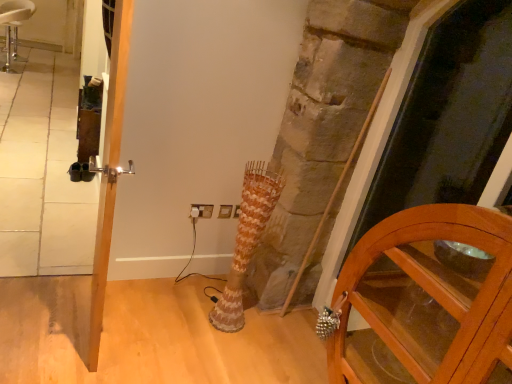
This screenshot has width=512, height=384. In order to click on free space behind polished silver door handle at left in this screenshot , I will do `click(132, 294)`.